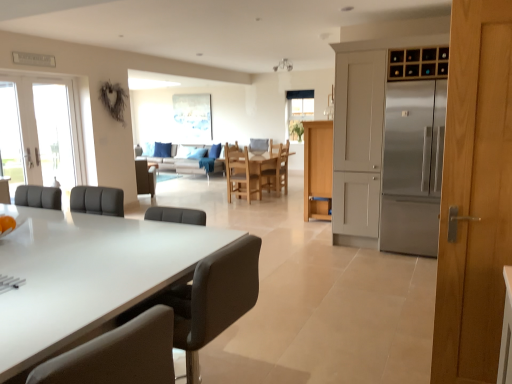
The width and height of the screenshot is (512, 384). Describe the element at coordinates (418, 63) in the screenshot. I see `wooden wine rack at upper right, which appears as the second cabinetry when viewed from the left` at that location.

Locate an element on the screen. matte black chair at lower left, acting as the 2th chair starting from the left is located at coordinates (118, 355).

Which is farther from the camera, (320, 207) or (75, 368)?

Positioned behind is point (320, 207).

Could you measure the distance between light wood cabinet at center, which is the second cabinetry in top-to-bottom order, and matte black chair at lower left, acting as the 2th chair starting from the left?

A distance of 5.51 meters exists between light wood cabinet at center, which is the second cabinetry in top-to-bottom order, and matte black chair at lower left, acting as the 2th chair starting from the left.

Is light wood cabinet at center, the second cabinetry viewed from the front, placed right next to matte black chair at lower left, acting as the 2th chair starting from the left?

No, light wood cabinet at center, the second cabinetry viewed from the front, is not in contact with matte black chair at lower left, acting as the 2th chair starting from the left.

Identify the location of the 2nd chair in front of the light wood cabinet at center, which is the second cabinetry in top-to-bottom order, counting from the anchor's position. This screenshot has width=512, height=384. (118, 355).

Can you confirm if matte black chair at lower left, the 5th chair when ordered from back to front, is taller than wooden chair at center, the 5th chair from the front?

Incorrect, the height of matte black chair at lower left, the 5th chair when ordered from back to front, is not larger of that of wooden chair at center, the 5th chair from the front.

From the picture: Is matte black chair at lower left, the 5th chair when ordered from back to front, positioned with its back to wooden chair at center, the 5th chair from the front?

matte black chair at lower left, the 5th chair when ordered from back to front, does not have its back to wooden chair at center, the 5th chair from the front.

Is matte black chair at lower left, acting as the 2th chair starting from the left, at the left side of wooden chair at center, the 5th chair from the front?

Indeed, matte black chair at lower left, acting as the 2th chair starting from the left, is positioned on the left side of wooden chair at center, the 5th chair from the front.

Is matte black chair at lower left, the 5th chair when ordered from back to front, spatially inside wooden chair at center, the fifth chair positioned from the left, or outside of it?

matte black chair at lower left, the 5th chair when ordered from back to front, is located beyond the bounds of wooden chair at center, the fifth chair positioned from the left.

Between wooden chair at center, the 5th chair from the front, and black leather chair at center, acting as the 3th chair starting from the left, which one has larger width?

black leather chair at center, acting as the 3th chair starting from the left, is wider.

Can you confirm if wooden chair at center, which is counted as the first chair, starting from the back, is positioned to the right of black leather chair at center, marked as the fourth chair in a back-to-front arrangement?

Yes.

Could you tell me if wooden chair at center, the 5th chair from the front, is turned towards black leather chair at center, arranged as the 3th chair when viewed from the right?

No, wooden chair at center, the 5th chair from the front, is not facing towards black leather chair at center, arranged as the 3th chair when viewed from the right.

Is wooden chair at center, the first chair in the right-to-left sequence, not inside black leather chair at center, marked as the fourth chair in a back-to-front arrangement?

Yes, wooden chair at center, the first chair in the right-to-left sequence, is located beyond the bounds of black leather chair at center, marked as the fourth chair in a back-to-front arrangement.

From the image's perspective, is white glossy countertop at center located above brown leather chair at center, the 1th chair viewed from the left?

No, from the image's perspective, white glossy countertop at center is not over brown leather chair at center, the 1th chair viewed from the left.

Which is more to the left, white glossy countertop at center or brown leather chair at center, the 1th chair viewed from the left?

Positioned to the left is brown leather chair at center, the 1th chair viewed from the left.

How different are the orientations of white glossy countertop at center and brown leather chair at center, positioned as the second chair in back-to-front order, in degrees?

white glossy countertop at center and brown leather chair at center, positioned as the second chair in back-to-front order, are facing 143 degrees away from each other.

Consider the image. Can you confirm if white glossy countertop at center is smaller than brown leather chair at center, the 5th chair in the right-to-left sequence?

No.

Is point (68, 231) closer or farther from the camera than point (284, 171)?

Clearly, point (68, 231) is closer to the camera than point (284, 171).

Is white glossy countertop at center not close to wooden chair at center, which is counted as the first chair, starting from the back?

Yes.

Between white glossy countertop at center and wooden chair at center, the 5th chair from the front, which one has larger size?

Bigger between the two is white glossy countertop at center.

Would you say matte black chair at lower left, the 5th chair when ordered from back to front, is outside wooden wine rack at upper right, marked as the 1th cabinetry in a right-to-left arrangement?

Yes, matte black chair at lower left, the 5th chair when ordered from back to front, is outside of wooden wine rack at upper right, marked as the 1th cabinetry in a right-to-left arrangement.

Which is in front, point (89, 368) or point (405, 59)?

Positioned in front is point (89, 368).

From a real-world perspective, is matte black chair at lower left, acting as the 2th chair starting from the left, above or below wooden wine rack at upper right, which appears as the second cabinetry when viewed from the left?

matte black chair at lower left, acting as the 2th chair starting from the left, is situated lower than wooden wine rack at upper right, which appears as the second cabinetry when viewed from the left, in the real world.

Looking at this image, are wooden wine rack at upper right, which ranks as the 1th cabinetry in top-to-bottom order, and wooden chair at center, the first chair in the right-to-left sequence, located far from each other?

wooden wine rack at upper right, which ranks as the 1th cabinetry in top-to-bottom order, is positioned a significant distance from wooden chair at center, the first chair in the right-to-left sequence.

Which object is more forward, wooden wine rack at upper right, acting as the 1th cabinetry starting from the front, or wooden chair at center, the fifth chair positioned from the left?

wooden wine rack at upper right, acting as the 1th cabinetry starting from the front.

Considering the relative positions of wooden wine rack at upper right, which appears as the second cabinetry when viewed from the left, and wooden chair at center, the first chair in the right-to-left sequence, in the image provided, is wooden wine rack at upper right, which appears as the second cabinetry when viewed from the left, to the left of wooden chair at center, the first chair in the right-to-left sequence, from the viewer's perspective?

No.

Does wooden wine rack at upper right, which appears as the second cabinetry when viewed from the left, have a lesser width compared to wooden chair at center, the first chair in the right-to-left sequence?

Correct, the width of wooden wine rack at upper right, which appears as the second cabinetry when viewed from the left, is less than that of wooden chair at center, the first chair in the right-to-left sequence.

Where is `the 4th chair to the left of the light wood cabinet at center, the 1th cabinetry viewed from the back, counting from the anchor's position`? the 4th chair to the left of the light wood cabinet at center, the 1th cabinetry viewed from the back, counting from the anchor's position is located at coordinates (118, 355).

From a real-world perspective, which chair is the 2nd one underneath the matte black chair at lower left, the 1th chair viewed from the front? Please provide its 2D coordinates.

[(277, 170)]

From the image, which object appears to be farther from matte black chair at lower left, the 1th chair viewed from the front, light wood cabinet at center, the second cabinetry viewed from the front, or black leather chair at center, acting as the 3th chair starting from the left?

Based on the image, light wood cabinet at center, the second cabinetry viewed from the front, appears to be further to matte black chair at lower left, the 1th chair viewed from the front.

Looking at the image, which one is located closer to light brown wood door at right, wooden chair at center, arranged as the third chair when viewed from the back, or matte black chair at lower left, the 1th chair viewed from the front?

matte black chair at lower left, the 1th chair viewed from the front, is closer to light brown wood door at right.

From the image, which object appears to be farther from matte black chair at lower left, the 5th chair when ordered from back to front, black leather chair at center, arranged as the 3th chair when viewed from the right, or light wood cabinet at center, the first cabinetry from the bottom?

light wood cabinet at center, the first cabinetry from the bottom, lies further to matte black chair at lower left, the 5th chair when ordered from back to front, than the other object.

From the image, which object appears to be nearer to white glass door at left, white glossy countertop at center or wooden chair at center, arranged as the third chair when viewed from the back?

Among the two, wooden chair at center, arranged as the third chair when viewed from the back, is located nearer to white glass door at left.

Estimate the real-world distances between objects in this image. Which object is closer to matte black chair at lower left, the fourth chair viewed from the right, light wood cabinet at center, the first cabinetry from the bottom, or wooden chair at center, positioned as the 2th chair in right-to-left order?

light wood cabinet at center, the first cabinetry from the bottom, is closer to matte black chair at lower left, the fourth chair viewed from the right.

From the image, which object appears to be nearer to wooden chair at center, placed as the 3th chair when sorted from front to back, wooden wine rack at upper right, marked as the 1th cabinetry in a right-to-left arrangement, or black leather chair at center, marked as the second chair in a front-to-back arrangement?

Among the two, wooden wine rack at upper right, marked as the 1th cabinetry in a right-to-left arrangement, is located nearer to wooden chair at center, placed as the 3th chair when sorted from front to back.

From the image, which object appears to be nearer to light brown wood door at right, stainless steel refrigerator at right or brown leather chair at center, the 5th chair in the right-to-left sequence?

stainless steel refrigerator at right lies closer to light brown wood door at right than the other object.

Looking at the image, which one is located closer to wooden wine rack at upper right, acting as the 1th cabinetry starting from the front, white glass door at left or light brown wood door at right?

light brown wood door at right.

Where is `cabinetry between wooden wine rack at upper right, which appears as the second cabinetry when viewed from the back, and wooden chair at center, arranged as the third chair when viewed from the back, in the front-back direction`? cabinetry between wooden wine rack at upper right, which appears as the second cabinetry when viewed from the back, and wooden chair at center, arranged as the third chair when viewed from the back, in the front-back direction is located at coordinates (318, 170).

At what (x,y) coordinates should I click in order to perform the action: click on refrigerator located between black leather chair at center, marked as the second chair in a front-to-back arrangement, and wooden chair at center, arranged as the third chair when viewed from the back, in the depth direction. Please return your answer as a coordinate pair (x, y). This screenshot has height=384, width=512. Looking at the image, I should click on (412, 166).

Where is `refrigerator between white glossy countertop at center and wooden chair at center, arranged as the third chair when viewed from the back, along the z-axis`? refrigerator between white glossy countertop at center and wooden chair at center, arranged as the third chair when viewed from the back, along the z-axis is located at coordinates (412, 166).

The image size is (512, 384). I want to click on cabinetry located between white glass door at left and light brown wood door at right in the left-right direction, so click(x=318, y=170).